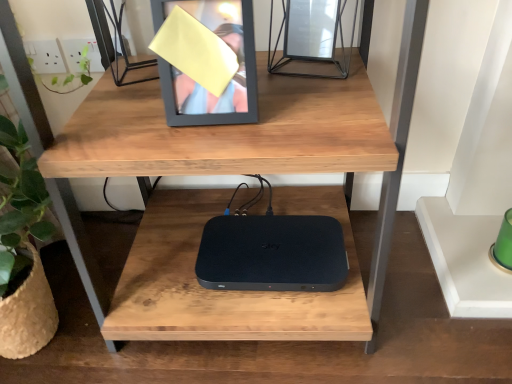
Question: Is matte black picture frame at upper center far away from black matte/solid sky box at center?

Choices:
 (A) no
 (B) yes

Answer: (A)

Question: Is matte black picture frame at upper center placed right next to black matte/solid sky box at center?

Choices:
 (A) no
 (B) yes

Answer: (A)

Question: Could you tell me if matte black picture frame at upper center is facing black matte/solid sky box at center?

Choices:
 (A) no
 (B) yes

Answer: (A)

Question: Can you confirm if matte black picture frame at upper center is smaller than black matte/solid sky box at center?

Choices:
 (A) yes
 (B) no

Answer: (B)

Question: Is black matte/solid sky box at center surrounded by matte black picture frame at upper center?

Choices:
 (A) yes
 (B) no

Answer: (B)

Question: Is matte black picture frame at upper center to the right of black matte/solid sky box at center from the viewer's perspective?

Choices:
 (A) yes
 (B) no

Answer: (B)

Question: Considering the relative positions of black matte/solid sky box at center and matte black picture frame at upper center in the image provided, is black matte/solid sky box at center to the right of matte black picture frame at upper center from the viewer's perspective?

Choices:
 (A) no
 (B) yes

Answer: (B)

Question: Is black matte/solid sky box at center aimed at matte black picture frame at upper center?

Choices:
 (A) no
 (B) yes

Answer: (A)

Question: Does black matte/solid sky box at center come in front of matte black picture frame at upper center?

Choices:
 (A) no
 (B) yes

Answer: (A)

Question: From the image's perspective, is black matte/solid sky box at center located beneath matte black picture frame at upper center?

Choices:
 (A) yes
 (B) no

Answer: (A)

Question: From a real-world perspective, is black matte/solid sky box at center below matte black picture frame at upper center?

Choices:
 (A) yes
 (B) no

Answer: (A)

Question: Considering the relative sizes of black matte/solid sky box at center and matte black picture frame at upper center in the image provided, is black matte/solid sky box at center taller than matte black picture frame at upper center?

Choices:
 (A) yes
 (B) no

Answer: (B)

Question: From a real-world perspective, is matte black picture frame at upper center physically located above or below black matte/solid sky box at center?

Choices:
 (A) below
 (B) above

Answer: (B)